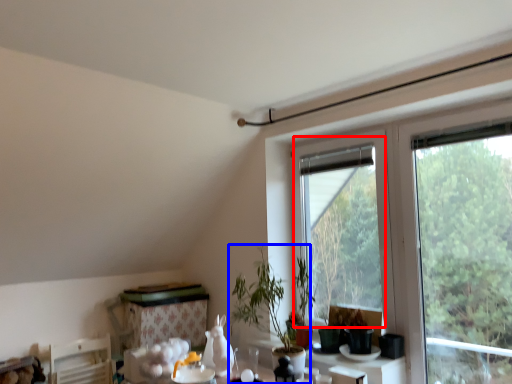
Question: Which point is further to the camera, bay window (highlighted by a red box) or houseplant (highlighted by a blue box)?

Choices:
 (A) bay window
 (B) houseplant

Answer: (A)